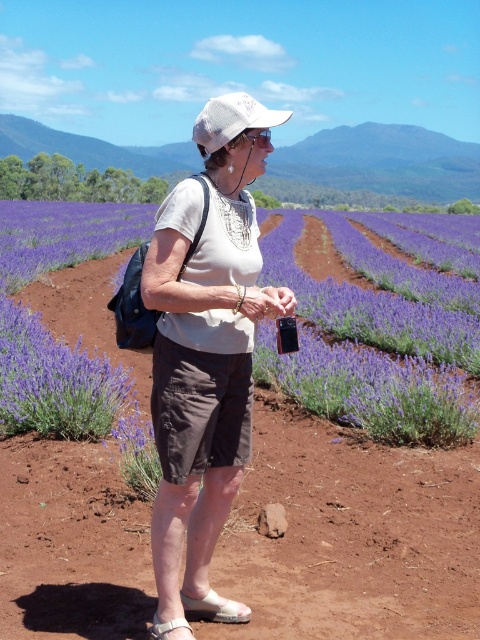
Who is positioned more to the right, brown soil at center or matte white hat at center?

matte white hat at center is more to the right.

Describe the element at coordinates (351, 536) in the screenshot. This screenshot has height=640, width=480. I see `brown soil at center` at that location.

Between point (332, 579) and point (179, 320), which one is positioned behind?

Point (332, 579)

Where is `brown soil at center`? brown soil at center is located at coordinates (351, 536).

Which is more to the right, matte white hat at center or purple soft lavender at center?

purple soft lavender at center

Does matte white hat at center have a greater width compared to purple soft lavender at center?

No, matte white hat at center is not wider than purple soft lavender at center.

Is point (184, 310) positioned before point (427, 440)?

That is True.

Find the location of `matte white hat at center`. matte white hat at center is located at coordinates (205, 353).

Does matte white hat at center come behind white textured baseball cap at center?

No.

Is point (267, 118) closer to viewer compared to point (223, 138)?

No, it is not.

You are a GUI agent. You are given a task and a screenshot of the screen. Output one action in this format:
    pyautogui.click(x=<x>, y=<y>)
    Task: Click on the matte white hat at center
    The width and height of the screenshot is (480, 640).
    Given the screenshot: What is the action you would take?
    pyautogui.click(x=205, y=353)